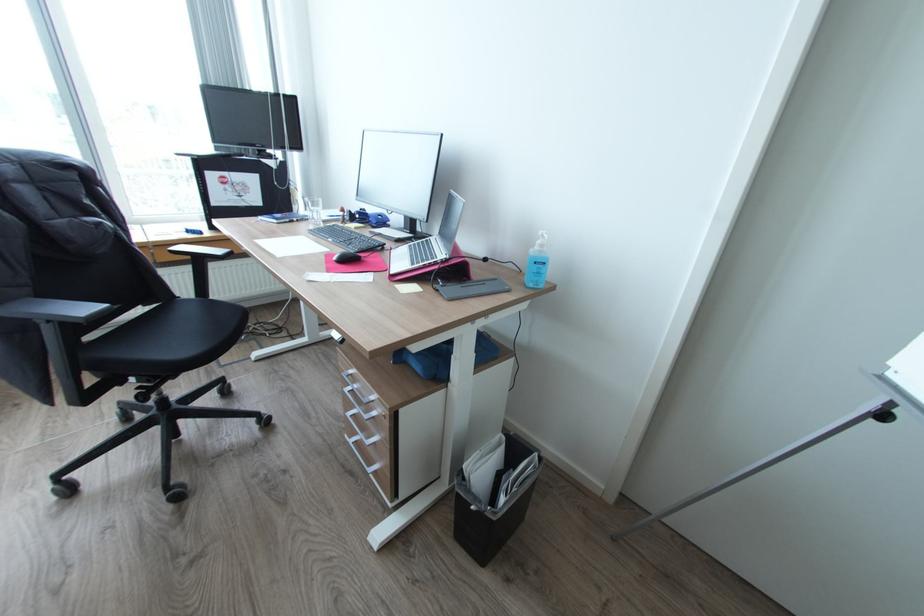
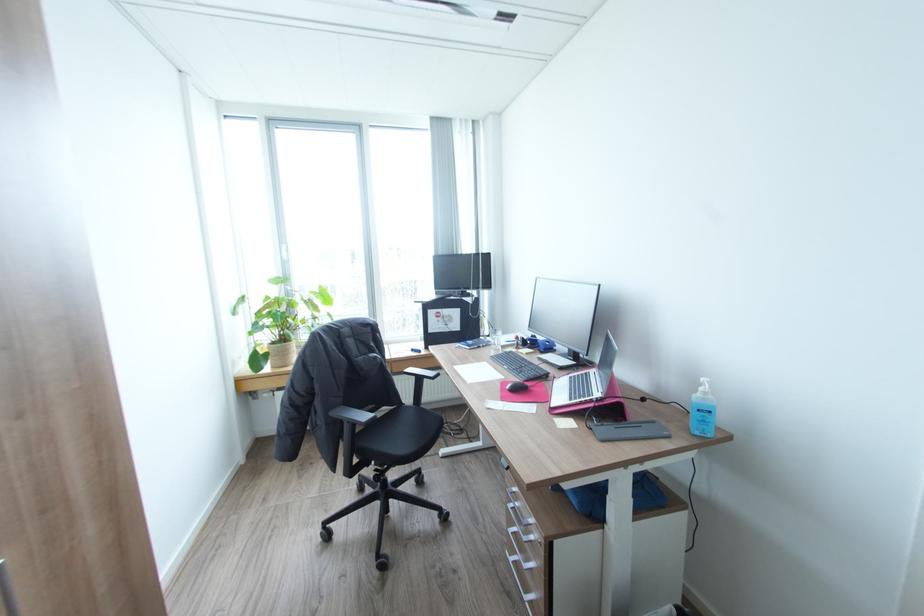
The point at (321, 217) is marked in the first image. Where is the corresponding point in the second image?

(502, 344)